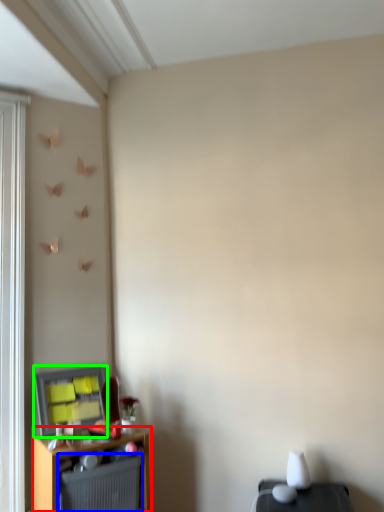
Question: Considering the real-world distances, which object is farthest from shelf (highlighted by a red box)? radiator (highlighted by a blue box) or window screen (highlighted by a green box)?

Choices:
 (A) radiator
 (B) window screen

Answer: (B)